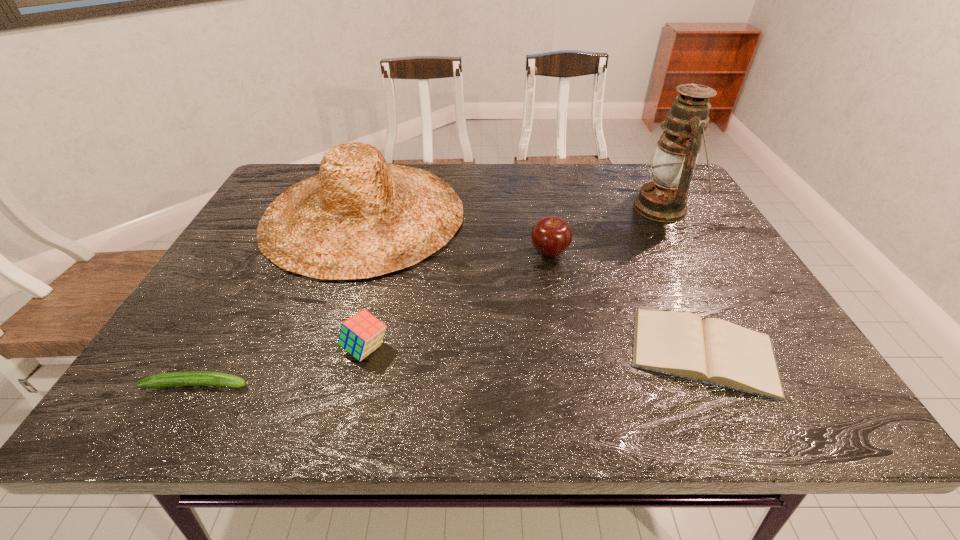
Where is `free space located on the right of the third shortest object`? The width and height of the screenshot is (960, 540). free space located on the right of the third shortest object is located at coordinates (464, 349).

Where is `free location located on the front-facing side of the zucchini`? This screenshot has width=960, height=540. free location located on the front-facing side of the zucchini is located at coordinates (451, 384).

Find the location of a particular element. vacant space located on the left of the Bible is located at coordinates 563,352.

This screenshot has width=960, height=540. In order to click on lantern that is at the far edge in this screenshot , I will do `click(664, 199)`.

The width and height of the screenshot is (960, 540). I want to click on sunhat that is at the far edge, so click(360, 217).

In order to click on zucchini positioned at the near edge in this screenshot , I will do `click(188, 378)`.

This screenshot has width=960, height=540. What are the coordinates of `Bible that is positioned at the near edge` in the screenshot? It's located at (713, 351).

The width and height of the screenshot is (960, 540). I want to click on sunhat that is positioned at the left edge, so click(360, 217).

The width and height of the screenshot is (960, 540). I want to click on zucchini located in the left edge section of the desktop, so click(x=188, y=378).

At what (x,y) coordinates should I click in order to perform the action: click on lantern located in the right edge section of the desktop. Please return your answer as a coordinate pair (x, y). This screenshot has width=960, height=540. Looking at the image, I should click on (664, 199).